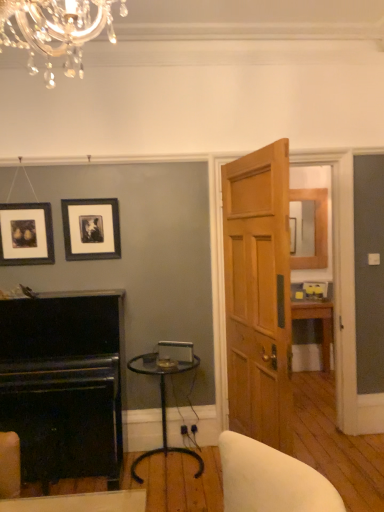
I want to click on free space above black matte picture frame at upper center, placed as the second picture frame when sorted from left to right (from a real-world perspective), so click(90, 199).